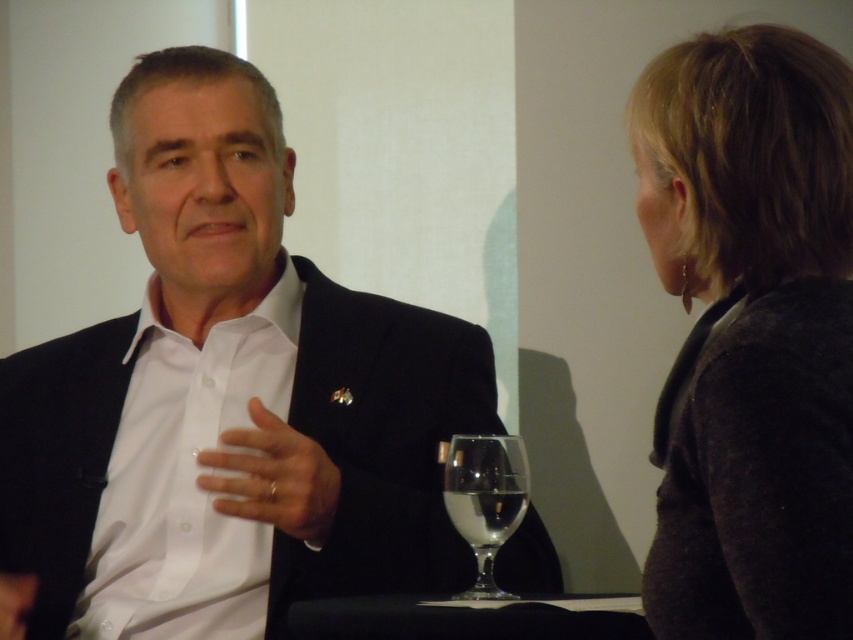
Between point (735, 580) and point (466, 492), which one is positioned behind?

The point (466, 492) is more distant.

Which is more to the left, dark gray sweater at upper right or clear glass wine at center?

clear glass wine at center is more to the left.

Is point (668, 388) positioned in front of point (524, 502)?

Yes, point (668, 388) is in front of point (524, 502).

Where is `dark gray sweater at upper right`? The height and width of the screenshot is (640, 853). dark gray sweater at upper right is located at coordinates coord(751,333).

Can you confirm if black glass table at center is thinner than clear glass wine glass at center?

No, black glass table at center is not thinner than clear glass wine glass at center.

Who is positioned more to the right, black glass table at center or clear glass wine glass at center?

Positioned to the right is clear glass wine glass at center.

Is point (550, 612) positioned before point (456, 436)?

Yes, it is.

The image size is (853, 640). What are the coordinates of `black glass table at center` in the screenshot? It's located at coord(468,618).

Can you confirm if black glass table at center is taller than clear glass wine at center?

Incorrect, black glass table at center's height is not larger of clear glass wine at center's.

Is black glass table at center thinner than clear glass wine at center?

No.

What do you see at coordinates (468, 618) in the screenshot? Image resolution: width=853 pixels, height=640 pixels. I see `black glass table at center` at bounding box center [468, 618].

You are a GUI agent. You are given a task and a screenshot of the screen. Output one action in this format:
    pyautogui.click(x=<x>, y=<y>)
    Task: Click on the black glass table at center
    The image size is (853, 640).
    Given the screenshot: What is the action you would take?
    pyautogui.click(x=468, y=618)